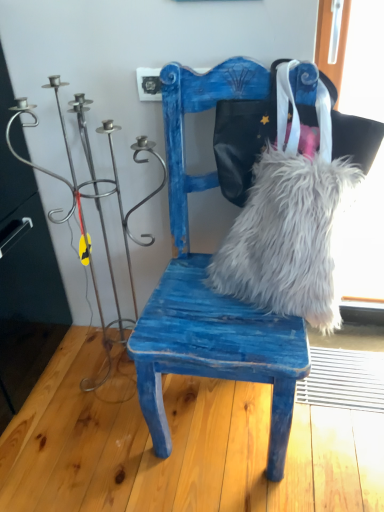
What is the approximate height of blue distressed wood chair at center?

The height of blue distressed wood chair at center is 1.00 meters.

Find the location of `metallic wire candle holder at left`. metallic wire candle holder at left is located at coordinates pos(93,199).

From a real-world perspective, is white fluffy fur at center physically above blue distressed wood chair at center?

No, from a real-world perspective, white fluffy fur at center is not over blue distressed wood chair at center

Based on the photo, is blue distressed wood chair at center at the back of white fluffy fur at center?

Yes, white fluffy fur at center is positioned with its back facing blue distressed wood chair at center.

How many degrees apart are the facing directions of white fluffy fur at center and blue distressed wood chair at center?

0.000271 degrees.

Which is behind, white fluffy fur at center or blue distressed wood chair at center?

Positioned behind is white fluffy fur at center.

Considering the positions of objects blue distressed wood chair at center and metallic wire candle holder at left in the image provided, who is behind, blue distressed wood chair at center or metallic wire candle holder at left?

metallic wire candle holder at left is more distant.

Is blue distressed wood chair at center looking in the opposite direction of metallic wire candle holder at left?

No.

From a real-world perspective, is blue distressed wood chair at center above or below metallic wire candle holder at left?

blue distressed wood chair at center is situated higher than metallic wire candle holder at left in the real world.

How many degrees apart are the facing directions of metallic wire candle holder at left and blue distressed wood chair at center?

They differ by 1.48 degrees in their facing directions.

From a real-world perspective, is metallic wire candle holder at left below blue distressed wood chair at center?

Yes, from a real-world perspective, metallic wire candle holder at left is below blue distressed wood chair at center.

Based on their sizes in the image, would you say metallic wire candle holder at left is bigger or smaller than blue distressed wood chair at center?

In the image, metallic wire candle holder at left appears to be smaller than blue distressed wood chair at center.

Which is less distant, (92,196) or (269,452)?

Clearly, point (92,196) is more distant from the camera than point (269,452).

Which object is positioned more to the right, metallic wire candle holder at left or white fluffy fur at center?

Positioned to the right is white fluffy fur at center.

Can you confirm if metallic wire candle holder at left is shorter than white fluffy fur at center?

No.

From a real-world perspective, is metallic wire candle holder at left positioned above or below white fluffy fur at center?

From a real-world perspective, metallic wire candle holder at left is physically above white fluffy fur at center.

From the picture: Which object is closer to the camera taking this photo, metallic wire candle holder at left or white fluffy fur at center?

metallic wire candle holder at left is more forward.

Which is more to the left, white fluffy fur at center or metallic wire candle holder at left?

Positioned to the left is metallic wire candle holder at left.

Is white fluffy fur at center facing towards metallic wire candle holder at left?

No, white fluffy fur at center is not facing towards metallic wire candle holder at left.

Does white fluffy fur at center come behind metallic wire candle holder at left?

Yes, it is.

Are white fluffy fur at center and metallic wire candle holder at left located far from each other?

That's not correct — white fluffy fur at center is a little close to metallic wire candle holder at left.

Are blue distressed wood chair at center and white fluffy fur at center located far from each other?

No, blue distressed wood chair at center is not far away from white fluffy fur at center.

Where is `fur that appears above the blue distressed wood chair at center (from the image's perspective)`? This screenshot has height=512, width=384. fur that appears above the blue distressed wood chair at center (from the image's perspective) is located at coordinates (289, 238).

From the image's perspective, is blue distressed wood chair at center above or below white fluffy fur at center?

Based on their image positions, blue distressed wood chair at center is located beneath white fluffy fur at center.

Considering the sizes of objects blue distressed wood chair at center and white fluffy fur at center in the image provided, who is thinner, blue distressed wood chair at center or white fluffy fur at center?

Thinner between the two is white fluffy fur at center.

I want to click on chair below the white fluffy fur at center (from the image's perspective), so click(208, 288).

Find the location of a particular element. The width and height of the screenshot is (384, 512). chair above the metallic wire candle holder at left (from a real-world perspective) is located at coordinates (208, 288).

Looking at the image, which one is located closer to metallic wire candle holder at left, white fluffy fur at center or blue distressed wood chair at center?

blue distressed wood chair at center lies closer to metallic wire candle holder at left than the other object.

Based on their spatial positions, is metallic wire candle holder at left or white fluffy fur at center further from blue distressed wood chair at center?

metallic wire candle holder at left is positioned further to the anchor blue distressed wood chair at center.

Considering their positions, is blue distressed wood chair at center positioned further to metallic wire candle holder at left than white fluffy fur at center?

Among the two, white fluffy fur at center is located further to metallic wire candle holder at left.

Based on their spatial positions, is white fluffy fur at center or metallic wire candle holder at left further from blue distressed wood chair at center?

metallic wire candle holder at left is positioned further to the anchor blue distressed wood chair at center.

Considering their positions, is blue distressed wood chair at center positioned further to white fluffy fur at center than metallic wire candle holder at left?

Among the two, metallic wire candle holder at left is located further to white fluffy fur at center.

Based on their spatial positions, is metallic wire candle holder at left or blue distressed wood chair at center further from white fluffy fur at center?

The object further to white fluffy fur at center is metallic wire candle holder at left.

I want to click on chair located between metallic wire candle holder at left and white fluffy fur at center in the left-right direction, so click(x=208, y=288).